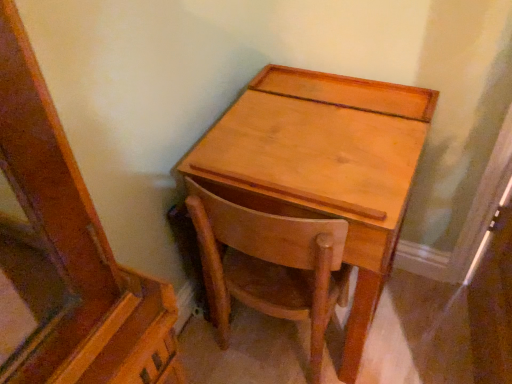
Question: Is light brown wood chair at center bigger or smaller than light brown wood desk at center?

Choices:
 (A) small
 (B) big

Answer: (A)

Question: From a real-world perspective, is light brown wood chair at center positioned above or below light brown wood desk at center?

Choices:
 (A) below
 (B) above

Answer: (A)

Question: In the image, is light brown wood chair at center on the left side or the right side of light brown wood desk at center?

Choices:
 (A) right
 (B) left

Answer: (B)

Question: From a real-world perspective, is light brown wood desk at center physically located above or below light brown wood chair at center?

Choices:
 (A) below
 (B) above

Answer: (B)

Question: Based on their sizes in the image, would you say light brown wood desk at center is bigger or smaller than light brown wood chair at center?

Choices:
 (A) small
 (B) big

Answer: (B)

Question: Is light brown wood desk at center wider or thinner than light brown wood chair at center?

Choices:
 (A) thin
 (B) wide

Answer: (B)

Question: In terms of height, does light brown wood desk at center look taller or shorter compared to light brown wood chair at center?

Choices:
 (A) tall
 (B) short

Answer: (A)